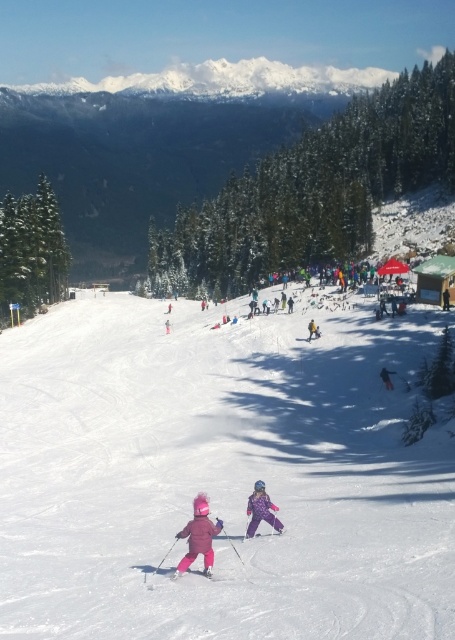
You are standing at the top of the slope and want to reach the two points marked in the image. Which point, point (392, 387) or point (317, 324), is closer to you?

Point (392, 387) is closer to the viewer than point (317, 324).

You are a photographer standing at the top of the slope. You want to take a photo of the yellow fabric jacket at center and the matte pink ski at center. The camera you are using has a minimum focus distance of 25 inches. Can you capture both subjects in focus without moving your position?

The yellow fabric jacket at center is 26.00 inches away from the matte pink ski at center. Since the minimum focus distance of the camera is 25 inches, the 26.00 inches distance between them is beyond the camera s capability. Therefore, you cannot capture both subjects in focus without moving closer.